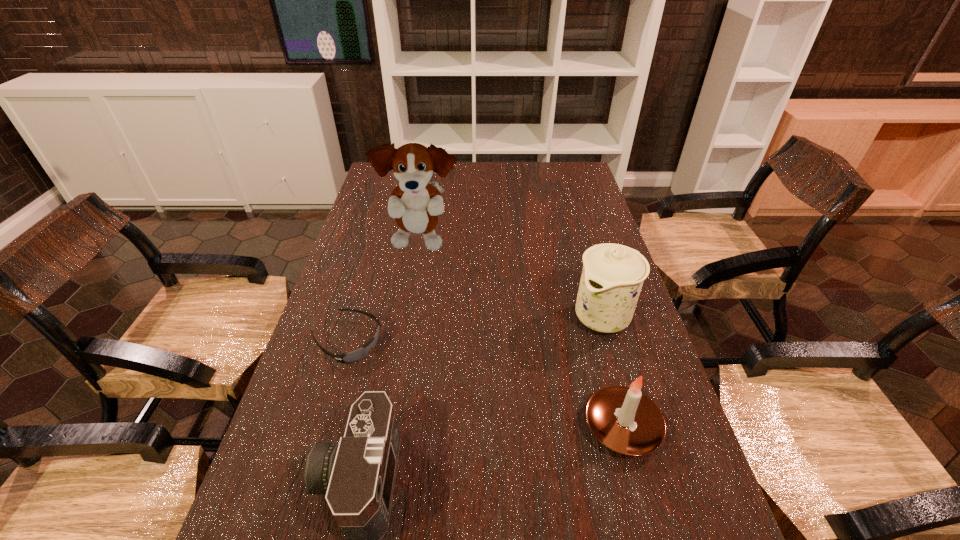
Point out which object is positioned as the third nearest to the candle. Please provide its 2D coordinates. Your answer should be formatted as a tuple, i.e. [(x, y)], where the tuple contains the x and y coordinates of a point satisfying the conditions above.

[(351, 357)]

Identify which object is located as the second nearest to the third tallest object. Please provide its 2D coordinates. Your answer should be formatted as a tuple, i.e. [(x, y)], where the tuple contains the x and y coordinates of a point satisfying the conditions above.

[(357, 474)]

Find the location of `blank space that satisfies the following two spatial constraints: 1. on the back side of the chinaware; 2. on the right side of the candle`. blank space that satisfies the following two spatial constraints: 1. on the back side of the chinaware; 2. on the right side of the candle is located at coordinates (593, 316).

The width and height of the screenshot is (960, 540). What are the coordinates of `vacant region that satisfies the following two spatial constraints: 1. on the front side of the second tallest object; 2. on the left side of the tallest object` in the screenshot? It's located at (409, 316).